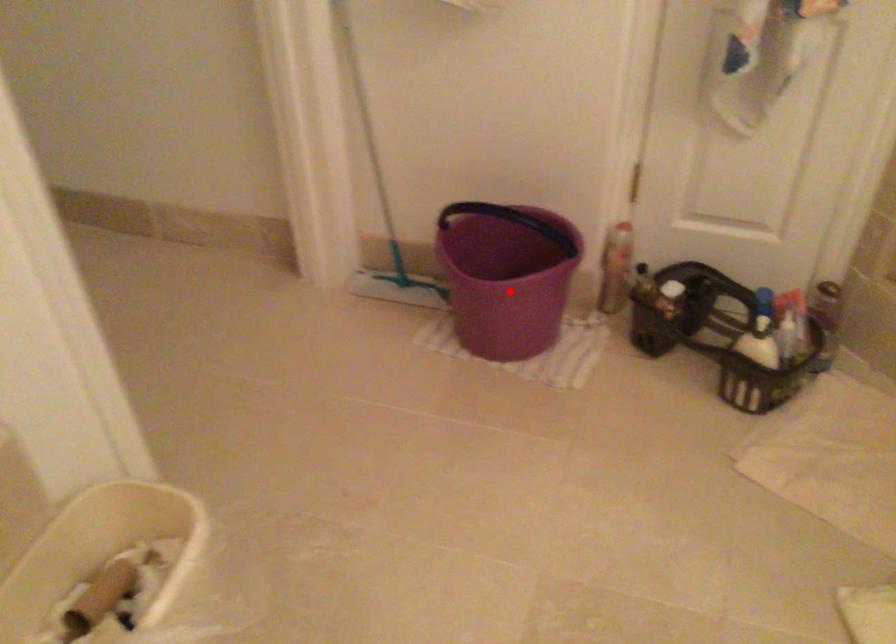
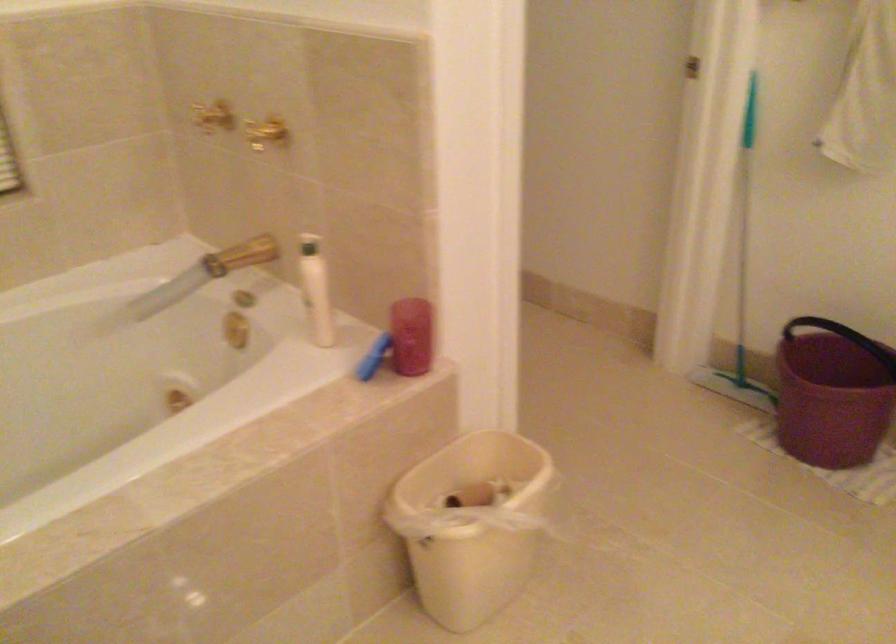
Question: I am providing you with two images of the same scene from different viewpoints. Given a red point in image1, look at the same physical point in image2. Is it:

Choices:
 (A) Closer to the viewpoint
 (B) Farther from the viewpoint

Answer: (B)